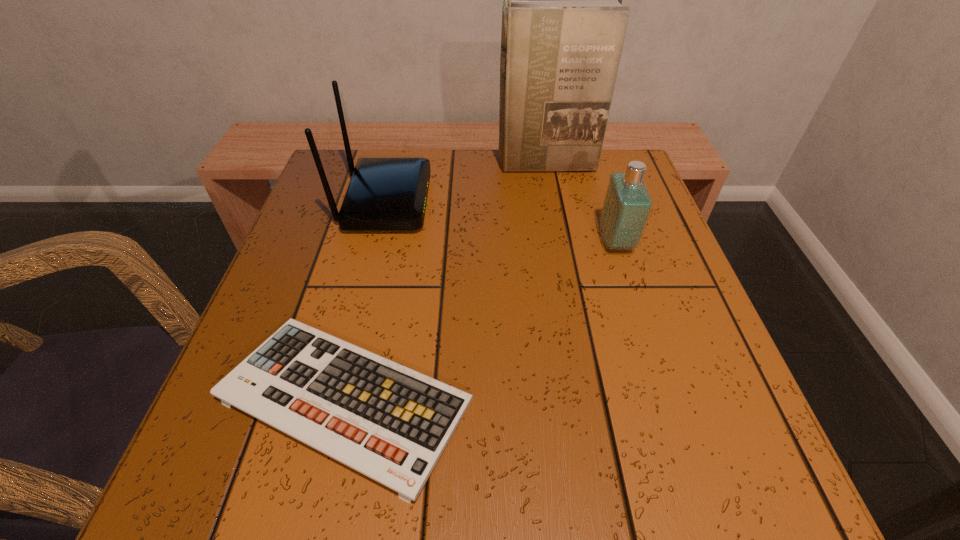
You are a GUI agent. You are given a task and a screenshot of the screen. Output one action in this format:
    pyautogui.click(x=<x>, y=<y>)
    Task: Click on the tallest object
    This screenshot has width=960, height=540.
    Given the screenshot: What is the action you would take?
    pyautogui.click(x=563, y=26)

Locate an element on the screen. the third shortest object is located at coordinates coord(385,193).

Locate an element on the screen. This screenshot has height=540, width=960. the third tallest object is located at coordinates (627, 204).

I want to click on the nearest object, so click(x=391, y=423).

Identify the location of the shortest object. Image resolution: width=960 pixels, height=540 pixels. (391, 423).

The height and width of the screenshot is (540, 960). What are the coordinates of `blank space located on the cover of the phonebook` in the screenshot? It's located at (551, 193).

The image size is (960, 540). Identify the location of vacant area situated 0.060m on the front-facing side of the second tallest object. (455, 201).

The height and width of the screenshot is (540, 960). I want to click on vacant space located on the front label of the third tallest object, so click(x=474, y=241).

The image size is (960, 540). In order to click on blank space located 0.100m on the front label of the third tallest object in this screenshot , I will do `click(550, 241)`.

Find the location of a particular element. free region located on the front label of the third tallest object is located at coordinates (474, 241).